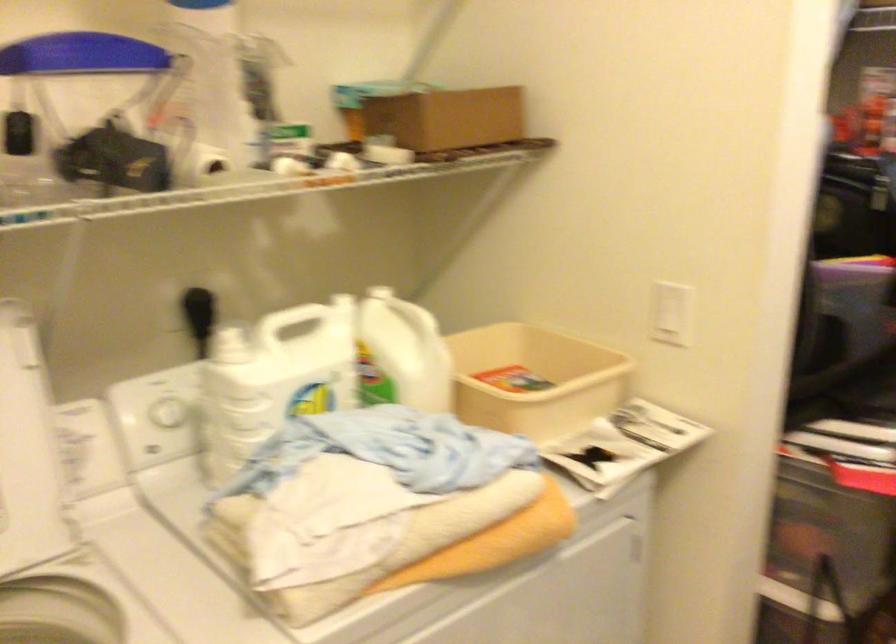
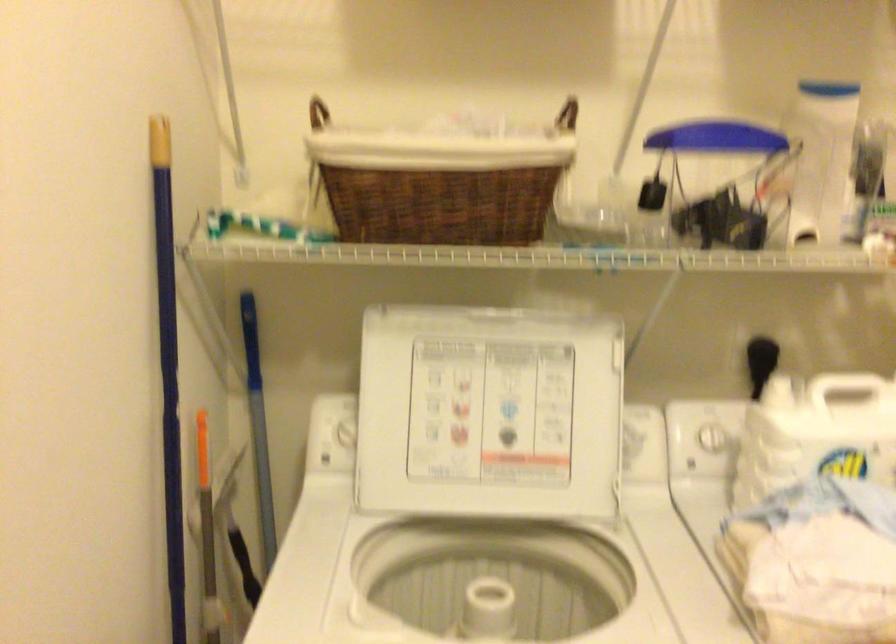
Find the pixel in the second image that matches point (151, 415) in the first image.

(698, 440)